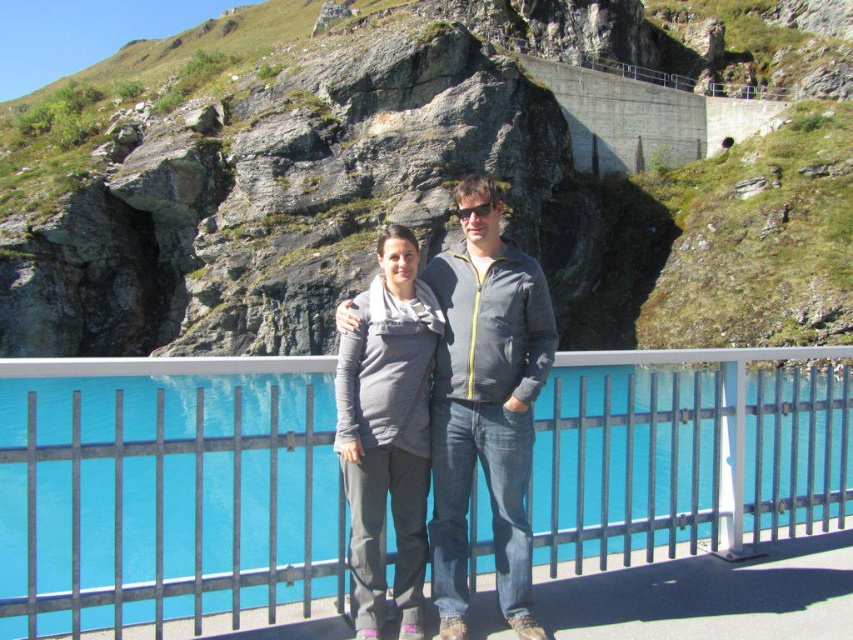
You are a photographer trying to capture a closeup shot of the black plastic sunglasses at center. You have a camera with a 10cm wide lens. The blue glass pool at center is blocking your view. Can you estimate if the sunglasses will fit within the camera lens without moving the camera?

The blue glass pool at center is wider than the black plastic sunglasses at center. Since the pool is blocking the view, it might be too wide to fit within the 10cm lens. However, since the sunglasses are narrower, if part of the pool is out of frame, the sunglasses could potentially fit. But without moving the camera, it depends on their exact positions.

You are a hiker who wants to place your black plastic sunglasses at center on a stable surface. The rough stone hillside at upper center is nearby. Can you place the sunglasses there?

The rough stone hillside at upper center is to the right of black plastic sunglasses at center, but the description does not mention if the hillside is stable enough to place the sunglasses. However, since the hillside is described as rough and rocky, it might not provide a stable surface for the sunglasses.